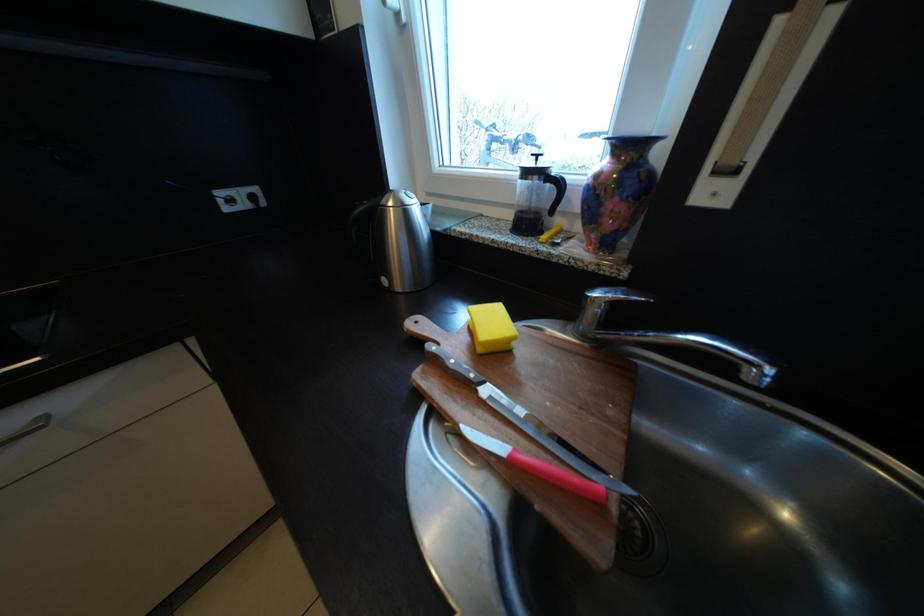
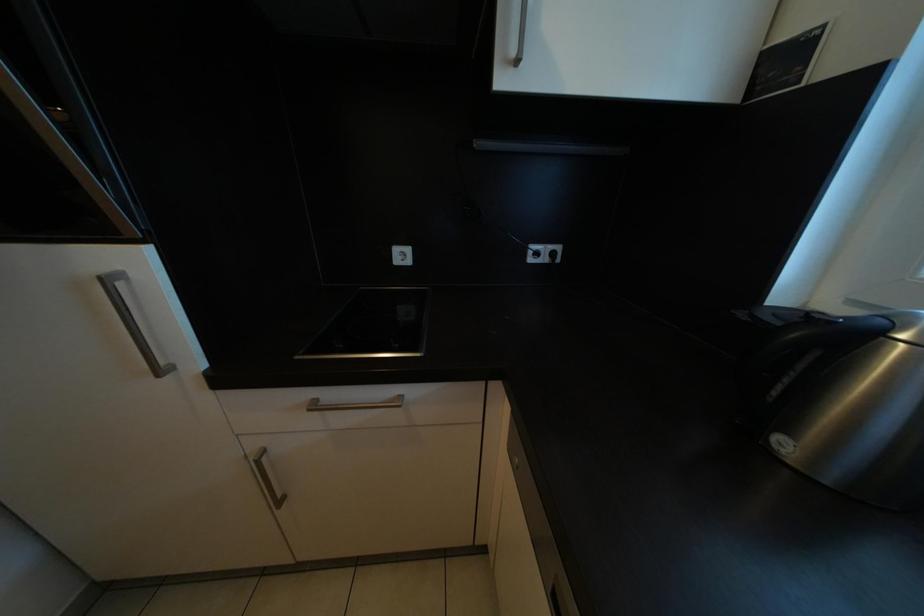
Question: The camera is either moving clockwise (left) or counter-clockwise (right) around the object. The first image is from the beginning of the video and the second image is from the end. Is the camera moving left or right when shooting the video?

Choices:
 (A) Left
 (B) Right

Answer: (B)